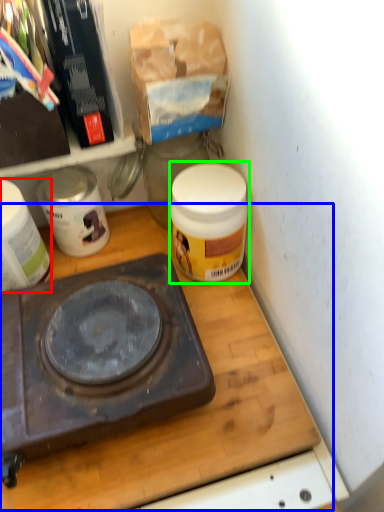
Question: Estimate the real-world distances between objects in this image. Which object is farther from appliance (highlighted by a red box), table (highlighted by a blue box) or product (highlighted by a green box)?

Choices:
 (A) table
 (B) product

Answer: (B)